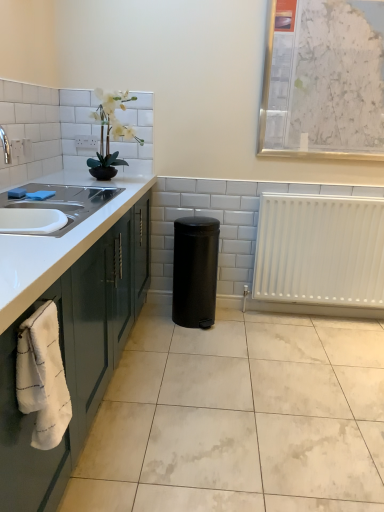
What do you see at coordinates (319, 255) in the screenshot? The width and height of the screenshot is (384, 512). I see `white plastic radiator at lower right` at bounding box center [319, 255].

Image resolution: width=384 pixels, height=512 pixels. What are the coordinates of `white plastic radiator at lower right` in the screenshot? It's located at (319, 255).

What is the approximate width of white glossy ceramic tile at lower center?

1.80 meters.

The image size is (384, 512). What are the coordinates of `white marble bulletin board at upper right` in the screenshot? It's located at (323, 79).

Could you tell me if white glossy countertop at left is facing white marble bulletin board at upper right?

No, white glossy countertop at left is not oriented towards white marble bulletin board at upper right.

Is white glossy countertop at left wider or thinner than white marble bulletin board at upper right?

Clearly, white glossy countertop at left has more width compared to white marble bulletin board at upper right.

Which is less distant, (95, 218) or (278, 0)?

Positioned in front is point (95, 218).

Between white glossy countertop at left and white marble bulletin board at upper right, which one has less height?

white marble bulletin board at upper right.

From the image's perspective, would you say white marble bulletin board at upper right is positioned over black matte trash can at center?

Indeed, from the image's perspective, white marble bulletin board at upper right is shown above black matte trash can at center.

Which is in front, point (355, 138) or point (173, 280)?

Positioned in front is point (355, 138).

From a real-world perspective, is white marble bulletin board at upper right physically located above or below black matte trash can at center?

From a real-world perspective, white marble bulletin board at upper right is physically above black matte trash can at center.

Locate an element on the screen. appliance below the white marble bulletin board at upper right (from a real-world perspective) is located at coordinates (195, 271).

From a real-world perspective, is black matte trash can at center physically above white plastic radiator at lower right?

Incorrect, from a real-world perspective, black matte trash can at center is lower than white plastic radiator at lower right.

Considering the sizes of objects black matte trash can at center and white plastic radiator at lower right in the image provided, who is wider, black matte trash can at center or white plastic radiator at lower right?

Wider between the two is black matte trash can at center.

Measure the distance from black matte trash can at center to white plastic radiator at lower right.

The distance of black matte trash can at center from white plastic radiator at lower right is 23.91 inches.

Is black matte trash can at center not inside white plastic radiator at lower right?

That's correct, black matte trash can at center is outside of white plastic radiator at lower right.

From a real-world perspective, who is located higher, white glossy ceramic tile at lower center or black matte trash can at center?

In real-world perspective, black matte trash can at center is above.

Is white glossy ceramic tile at lower center turned away from black matte trash can at center?

No, white glossy ceramic tile at lower center is not facing away from black matte trash can at center.

Relative to black matte trash can at center, is white glossy ceramic tile at lower center in front or behind?

Clearly, white glossy ceramic tile at lower center is in front of black matte trash can at center.

How much distance is there between white glossy ceramic tile at lower center and black matte trash can at center?

A distance of 28.48 inches exists between white glossy ceramic tile at lower center and black matte trash can at center.

Considering the positions of point (273, 398) and point (108, 268), is point (273, 398) closer or farther from the camera than point (108, 268)?

Point (273, 398) appears to be farther away from the viewer than point (108, 268).

Is white glossy ceramic tile at lower center inside the boundaries of white glossy countertop at left, or outside?

white glossy ceramic tile at lower center lies outside white glossy countertop at left.

Can you confirm if white glossy ceramic tile at lower center is thinner than white glossy countertop at left?

No, white glossy ceramic tile at lower center is not thinner than white glossy countertop at left.

What's the angular difference between white plastic radiator at lower right and white marble bulletin board at upper right's facing directions?

They differ by 0.0066 degrees in their facing directions.

Would you consider white plastic radiator at lower right to be distant from white marble bulletin board at upper right?

No, white plastic radiator at lower right is in close proximity to white marble bulletin board at upper right.

Does white plastic radiator at lower right have a lesser height compared to white marble bulletin board at upper right?

Indeed, white plastic radiator at lower right has a lesser height compared to white marble bulletin board at upper right.

Is white marble bulletin board at upper right inside white plastic radiator at lower right?

No, white marble bulletin board at upper right is not surrounded by white plastic radiator at lower right.

The height and width of the screenshot is (512, 384). I want to click on radiator that appears on the right of white glossy countertop at left, so click(x=319, y=255).

From the image's perspective, which is below, white plastic radiator at lower right or white glossy countertop at left?

From the image's view, white glossy countertop at left is below.

From a real-world perspective, is white plastic radiator at lower right physically above white glossy countertop at left?

Correct, in the physical world, white plastic radiator at lower right is higher than white glossy countertop at left.

In the image, is white plastic radiator at lower right on the left side or the right side of white glossy countertop at left?

From the image, it's evident that white plastic radiator at lower right is to the right of white glossy countertop at left.

Where is `countertop in front of the white marble bulletin board at upper right`? The image size is (384, 512). countertop in front of the white marble bulletin board at upper right is located at coordinates (68, 324).

Locate an element on the screen. The width and height of the screenshot is (384, 512). appliance below the white marble bulletin board at upper right (from a real-world perspective) is located at coordinates (195, 271).

Based on their spatial positions, is black matte trash can at center or white glossy countertop at left further from white marble bulletin board at upper right?

Based on the image, white glossy countertop at left appears to be further to white marble bulletin board at upper right.

Looking at the image, which one is located closer to white glossy ceramic tile at lower center, white glossy countertop at left or black matte trash can at center?

The object closer to white glossy ceramic tile at lower center is white glossy countertop at left.

Looking at the image, which one is located further to white marble bulletin board at upper right, black matte trash can at center or white plastic radiator at lower right?

black matte trash can at center.

Looking at the image, which one is located further to white glossy ceramic tile at lower center, white plastic radiator at lower right or white glossy countertop at left?

Among the two, white plastic radiator at lower right is located further to white glossy ceramic tile at lower center.

Looking at the image, which one is located further to black matte trash can at center, white glossy countertop at left or white marble bulletin board at upper right?

The object further to black matte trash can at center is white marble bulletin board at upper right.

When comparing their distances from white glossy countertop at left, does white glossy ceramic tile at lower center or black matte trash can at center seem closer?

The object closer to white glossy countertop at left is white glossy ceramic tile at lower center.

When comparing their distances from white glossy countertop at left, does black matte trash can at center or white glossy ceramic tile at lower center seem further?

black matte trash can at center.

When comparing their distances from black matte trash can at center, does white marble bulletin board at upper right or white plastic radiator at lower right seem closer?

white plastic radiator at lower right lies closer to black matte trash can at center than the other object.

You are a GUI agent. You are given a task and a screenshot of the screen. Output one action in this format:
    pyautogui.click(x=<x>, y=<y>)
    Task: Click on the countertop between white marble bulletin board at upper right and white glossy ceramic tile at lower center vertically
    This screenshot has height=512, width=384.
    Given the screenshot: What is the action you would take?
    pyautogui.click(x=68, y=324)

Image resolution: width=384 pixels, height=512 pixels. In order to click on appliance positioned between white glossy countertop at left and white plastic radiator at lower right from near to far in this screenshot , I will do `click(195, 271)`.

Identify the location of appliance located between white glossy ceramic tile at lower center and white plastic radiator at lower right in the depth direction. The image size is (384, 512). (195, 271).

You are a GUI agent. You are given a task and a screenshot of the screen. Output one action in this format:
    pyautogui.click(x=<x>, y=<y>)
    Task: Click on the appliance between white marble bulletin board at upper right and white glossy ceramic tile at lower center in the vertical direction
    Image resolution: width=384 pixels, height=512 pixels.
    Given the screenshot: What is the action you would take?
    195,271